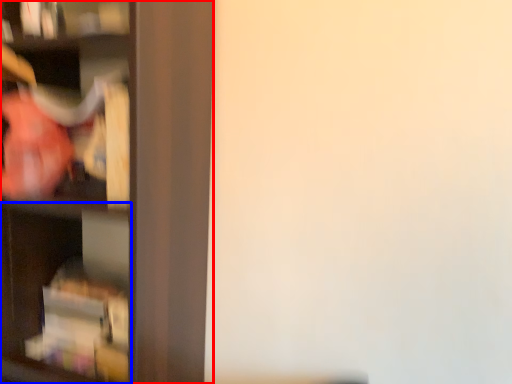
Question: Which object is closer to the camera taking this photo, shelf (highlighted by a red box) or cabinet (highlighted by a blue box)?

Choices:
 (A) shelf
 (B) cabinet

Answer: (A)